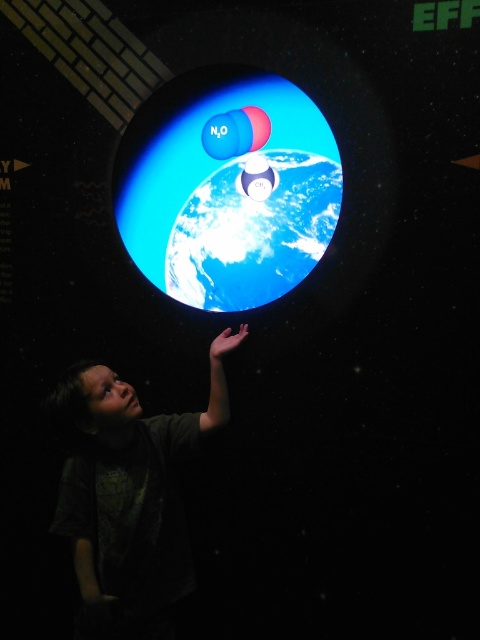
Is blue glossy sphere at center to the right of dark gray shirt at lower left from the viewer's perspective?

Indeed, blue glossy sphere at center is positioned on the right side of dark gray shirt at lower left.

Is blue glossy sphere at center bigger than dark gray shirt at lower left?

Incorrect, blue glossy sphere at center is not larger than dark gray shirt at lower left.

The image size is (480, 640). I want to click on blue glossy sphere at center, so click(228, 189).

At what (x,y) coordinates should I click in order to perform the action: click on blue glossy sphere at center. Please return your answer as a coordinate pair (x, y). The width and height of the screenshot is (480, 640). Looking at the image, I should click on (228, 189).